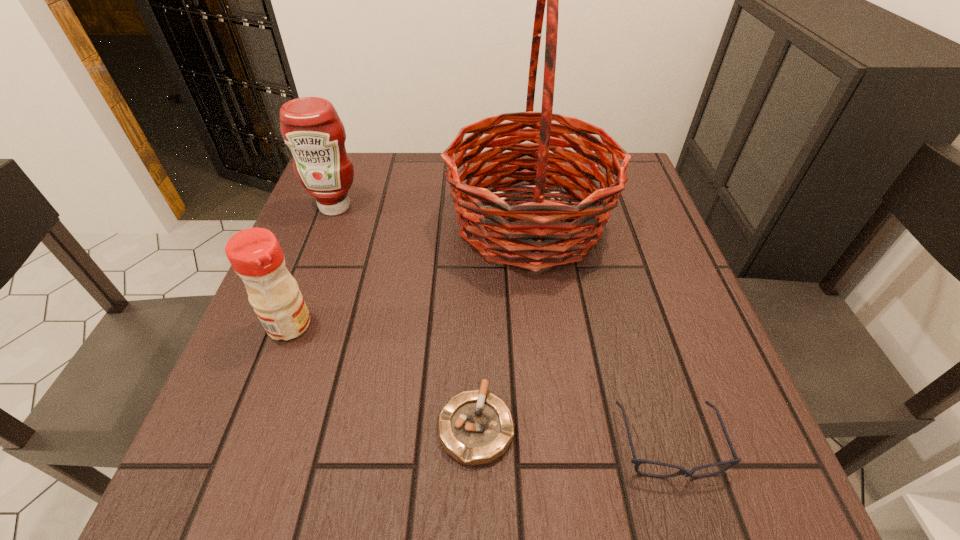
The image size is (960, 540). I want to click on free space located on the right of the farther condiment, so click(x=439, y=207).

Where is `free space located on the back of the third farthest object`? free space located on the back of the third farthest object is located at coordinates (335, 204).

This screenshot has height=540, width=960. Identify the location of free location located 0.140m on the back of the shortest object. (476, 323).

In order to click on basket positioned at the far edge in this screenshot , I will do `click(518, 235)`.

Locate an element on the screen. This screenshot has width=960, height=540. condiment that is at the far edge is located at coordinates (310, 126).

The image size is (960, 540). I want to click on spectacles that is at the near edge, so click(x=682, y=471).

This screenshot has height=540, width=960. I want to click on ashtray that is at the near edge, so pos(475,427).

At what (x,y) coordinates should I click in order to perform the action: click on basket at the right edge. Please return your answer as a coordinate pair (x, y). This screenshot has height=540, width=960. Looking at the image, I should click on (518, 235).

Where is `spectacles positioned at the right edge`? The width and height of the screenshot is (960, 540). spectacles positioned at the right edge is located at coordinates (682, 471).

Find the location of a particular element. This screenshot has width=960, height=540. object at the far left corner is located at coordinates (310, 126).